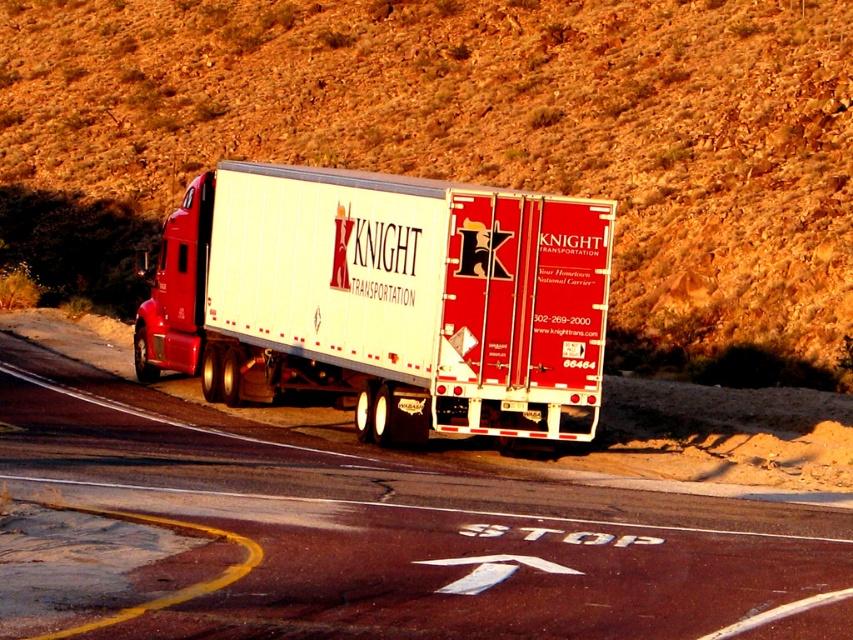
Is brown textured hillside at upper center bigger than smooth asphalt road at center?

Correct, brown textured hillside at upper center is larger in size than smooth asphalt road at center.

Can you confirm if brown textured hillside at upper center is positioned to the right of smooth asphalt road at center?

Yes, brown textured hillside at upper center is to the right of smooth asphalt road at center.

Where is `brown textured hillside at upper center`? This screenshot has height=640, width=853. brown textured hillside at upper center is located at coordinates (471, 141).

Which is more to the left, smooth asphalt road at center or white glossy trailer truck at center?

From the viewer's perspective, smooth asphalt road at center appears more on the left side.

You are a GUI agent. You are given a task and a screenshot of the screen. Output one action in this format:
    pyautogui.click(x=<x>, y=<y>)
    Task: Click on the smooth asphalt road at center
    The height and width of the screenshot is (640, 853).
    Given the screenshot: What is the action you would take?
    pyautogui.click(x=395, y=532)

Between point (97, 380) and point (369, 304), which one is positioned behind?

The point (97, 380) is behind.

Identify the location of smooth asphalt road at center. The image size is (853, 640). (395, 532).

Is point (428, 129) less distant than point (190, 278)?

No.

Is brown textured hillside at upper center wider than white glossy trailer truck at center?

Yes, brown textured hillside at upper center is wider than white glossy trailer truck at center.

Which is behind, point (128, 88) or point (149, 353)?

Positioned behind is point (128, 88).

You are a GUI agent. You are given a task and a screenshot of the screen. Output one action in this format:
    pyautogui.click(x=<x>, y=<y>)
    Task: Click on the brown textured hillside at upper center
    Image resolution: width=853 pixels, height=640 pixels.
    Given the screenshot: What is the action you would take?
    pyautogui.click(x=471, y=141)